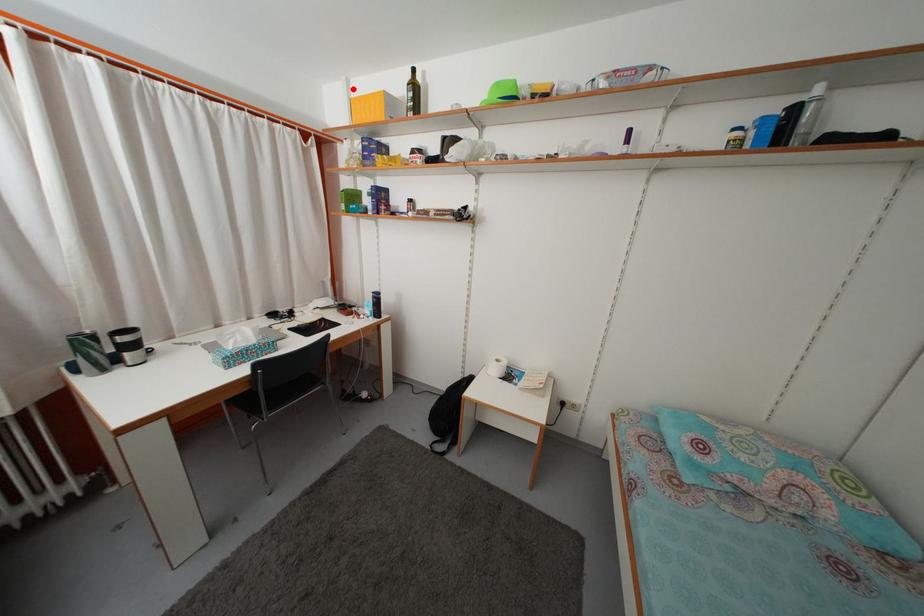
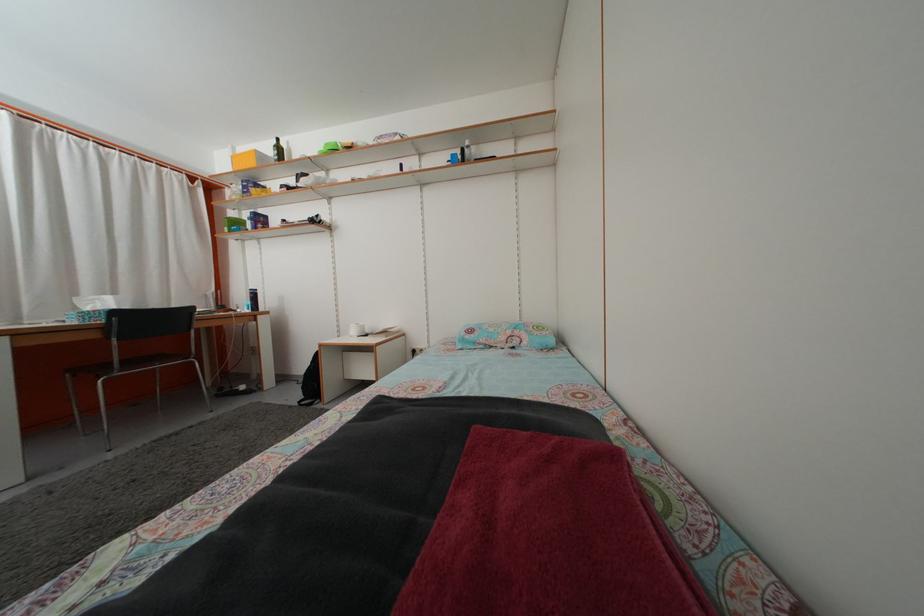
The point at the highlighted location is marked in the first image. Where is the corresponding point in the second image?

(239, 156)